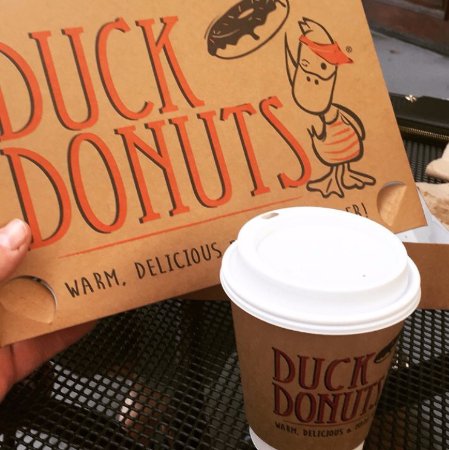
Identify the location of brown coffee cup safety wrap. (259, 345).